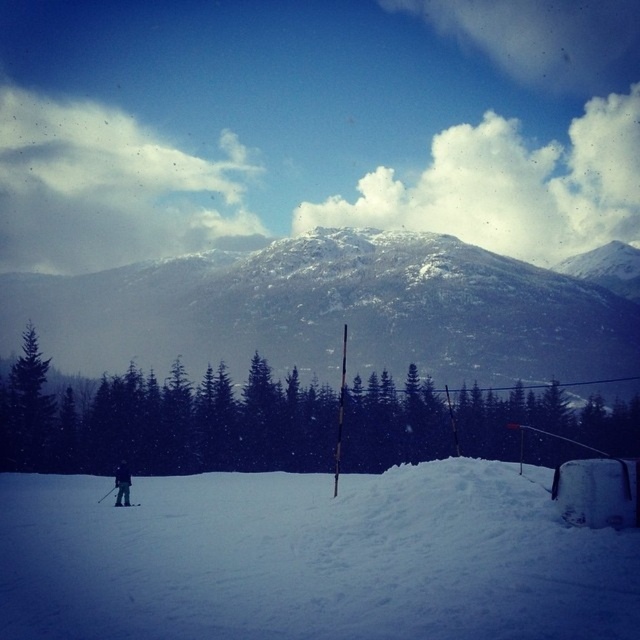
You are standing at the base of the snowy rocky mountain at center. You want to reach the top of the mountain. If your average climbing speed is 0.5 meters per second, how many minutes will it take you to reach the top?

The distance between the snowy rocky mountain at center and the viewer is 186.74 meters. Since you are at the base, the vertical distance to the top would be less than 186.74 meters. However, without knowing the exact elevation gain, we cannot calculate the exact time required to reach the top. Climbing time also depends on factors like path difficulty and rest periods.

You are a hiker planning to take a photo of the snowy rocky mountain at center and the green matte tree at center. Which object should you focus on first to ensure both are in the frame?

You should focus on the green matte tree at center first because it is closer to you than the snowy rocky mountain at center, so adjusting the focus starting from the closer object ensures both are in the frame.

You are planning to build a snowman using the white powdery snow at lower left and the snowy rocky mountain at center. Which object should you choose for the base of the snowman?

The white powdery snow at lower left should be chosen for the base of the snowman because it is located below the snowy rocky mountain at center, indicating it has a larger quantity of accessible snow.